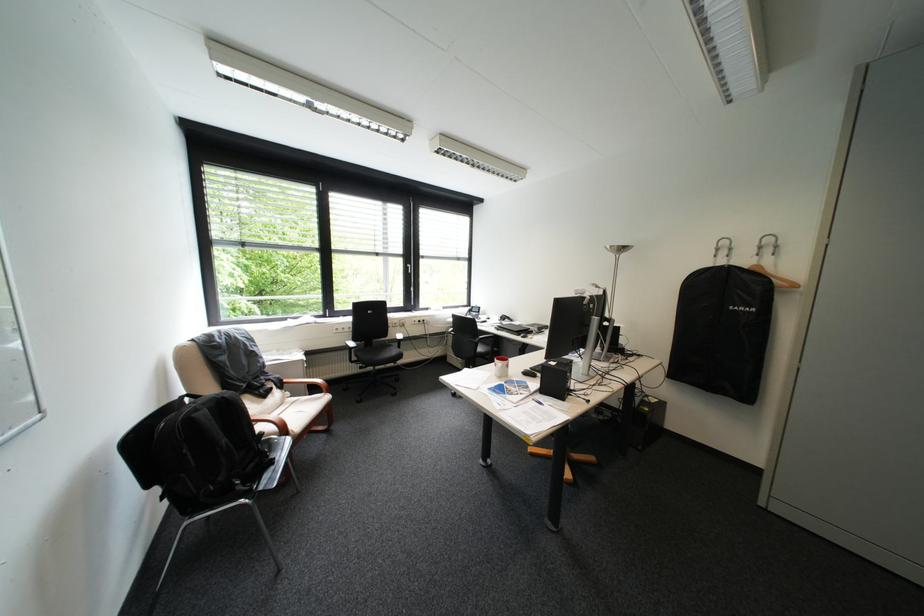
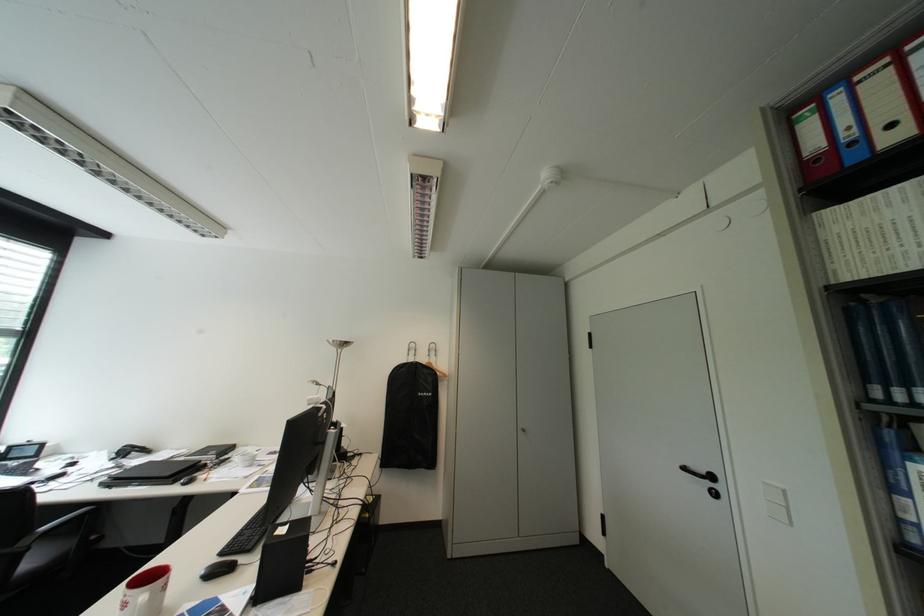
Question: The camera is either moving clockwise (left) or counter-clockwise (right) around the object. The first image is from the beginning of the video and the second image is from the end. Is the camera moving left or right when shooting the video?

Choices:
 (A) Left
 (B) Right

Answer: (A)